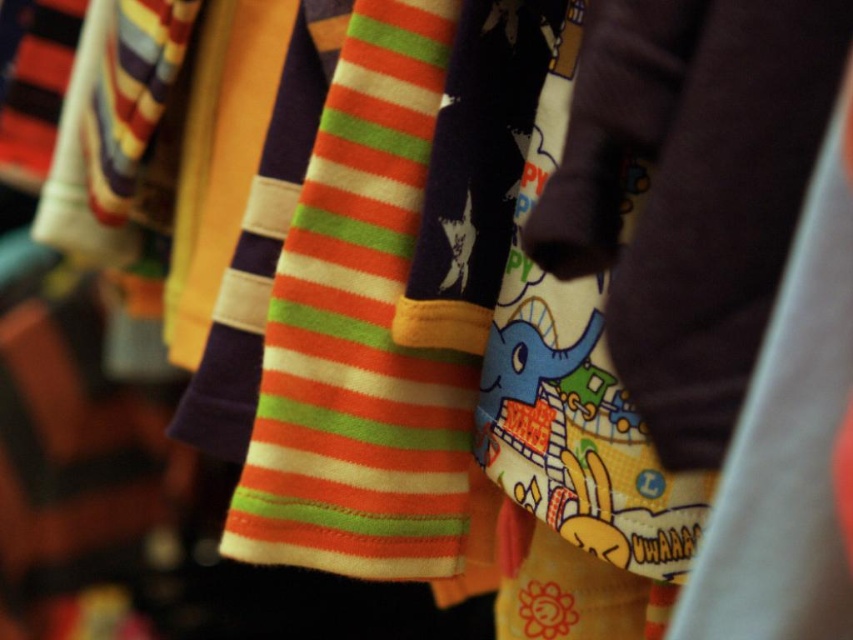
What is the object located at the coordinates point (474, 172)?

The object located at point (474, 172) is the matte purple tie at center.

You are a tailor who needs to determine which of the two garments in the center has a wider width. You see the matte purple tie at center and the orange striped fabric at center. Which one is wider?

The orange striped fabric at center is wider than the matte purple tie at center.